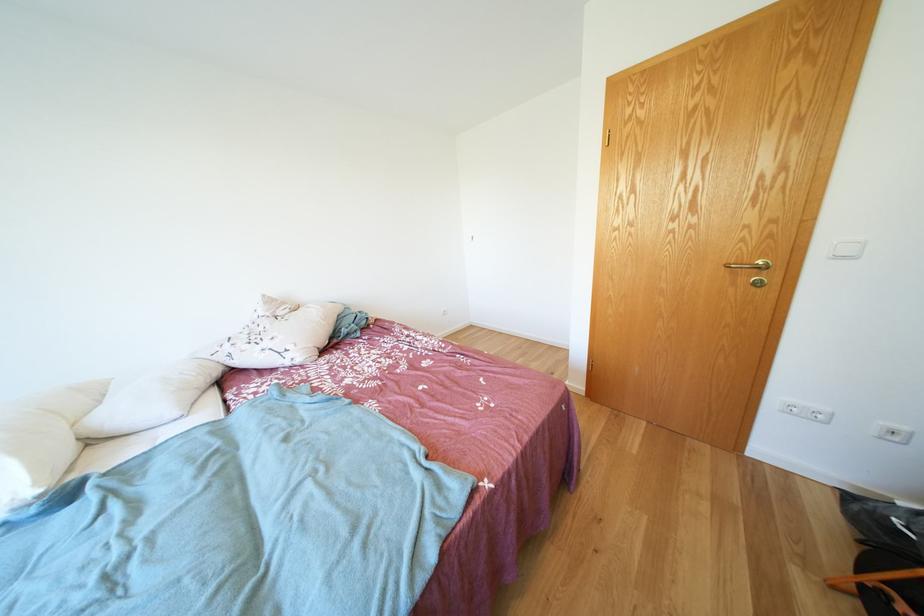
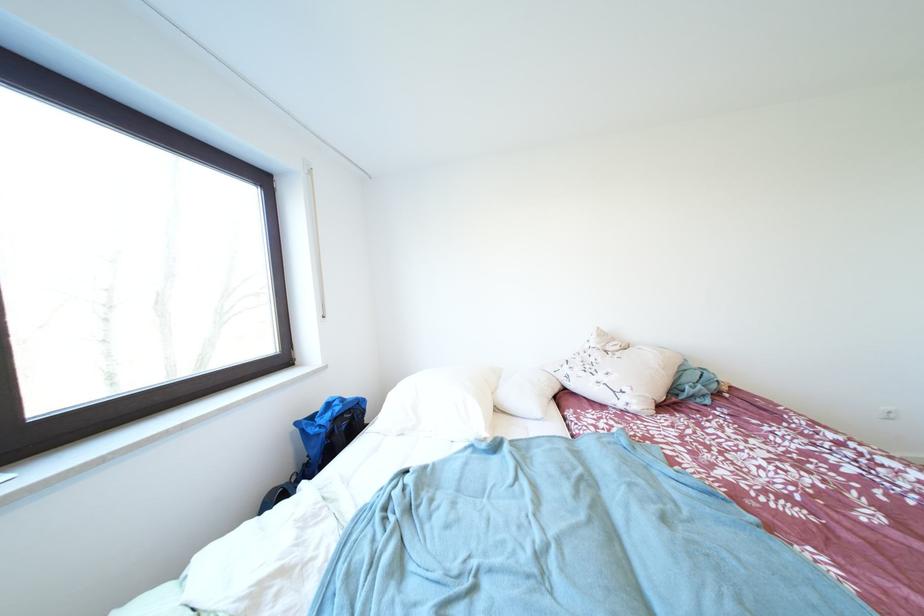
Where in the second image is the point corresponding to pixel 26 495 from the first image?

(488, 432)